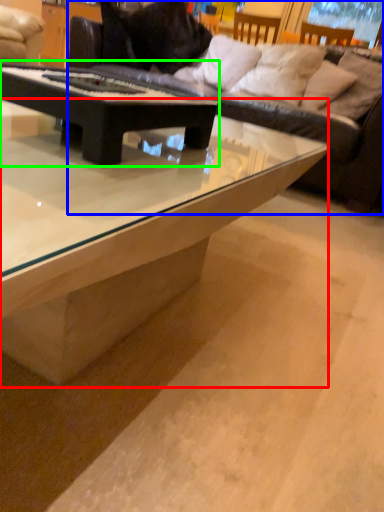
Question: Which object is the farthest from coffee table (highlighted by a red box)? Choose among these: studio couch (highlighted by a blue box) or coffee table (highlighted by a green box).

Choices:
 (A) studio couch
 (B) coffee table

Answer: (A)